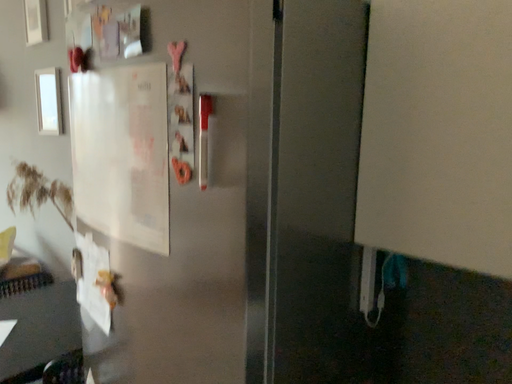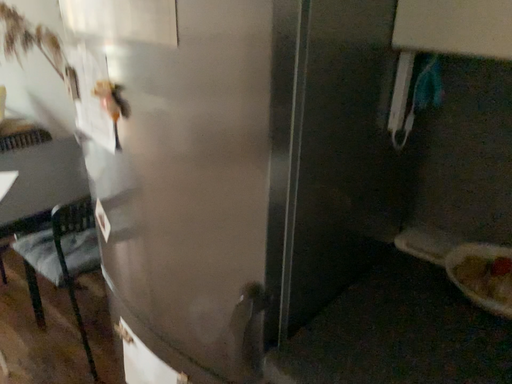
Question: How did the camera likely rotate when shooting the video?

Choices:
 (A) rotated downward
 (B) rotated upward

Answer: (A)